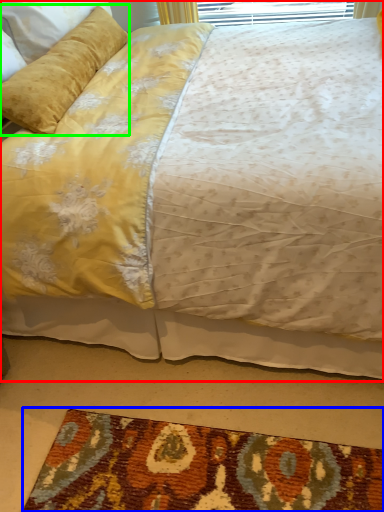
Question: Which object is positioned farthest from bed (highlighted by a red box)? Select from mat (highlighted by a blue box) and pillow (highlighted by a green box).

Choices:
 (A) mat
 (B) pillow

Answer: (A)